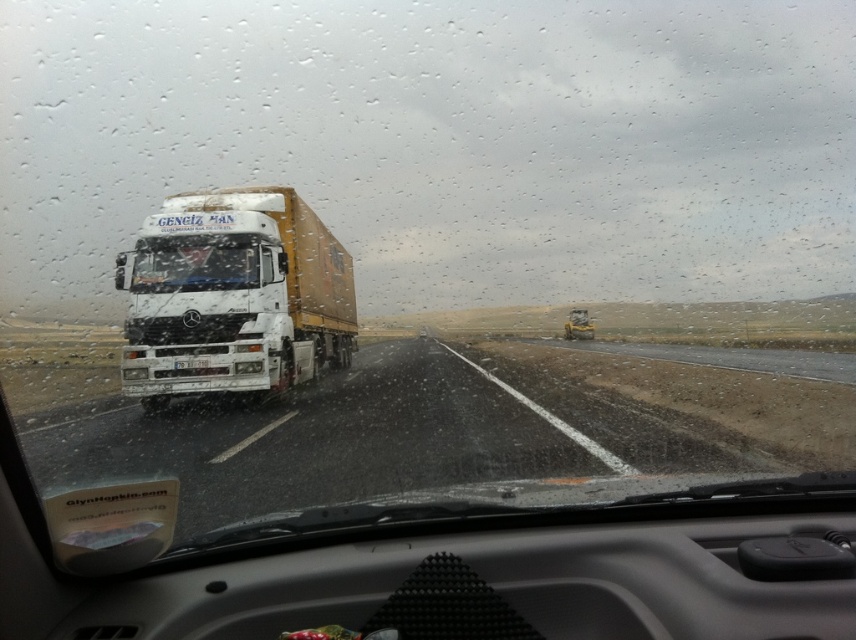
Does white matte trailer truck at center appear on the right side of transparent glass windshield at center?

Correct, you'll find white matte trailer truck at center to the right of transparent glass windshield at center.

Does point (156, 317) come farther from viewer compared to point (201, 282)?

No, (156, 317) is in front of (201, 282).

You are a GUI agent. You are given a task and a screenshot of the screen. Output one action in this format:
    pyautogui.click(x=<x>, y=<y>)
    Task: Click on the white matte trailer truck at center
    The image size is (856, 640).
    Given the screenshot: What is the action you would take?
    pyautogui.click(x=235, y=296)